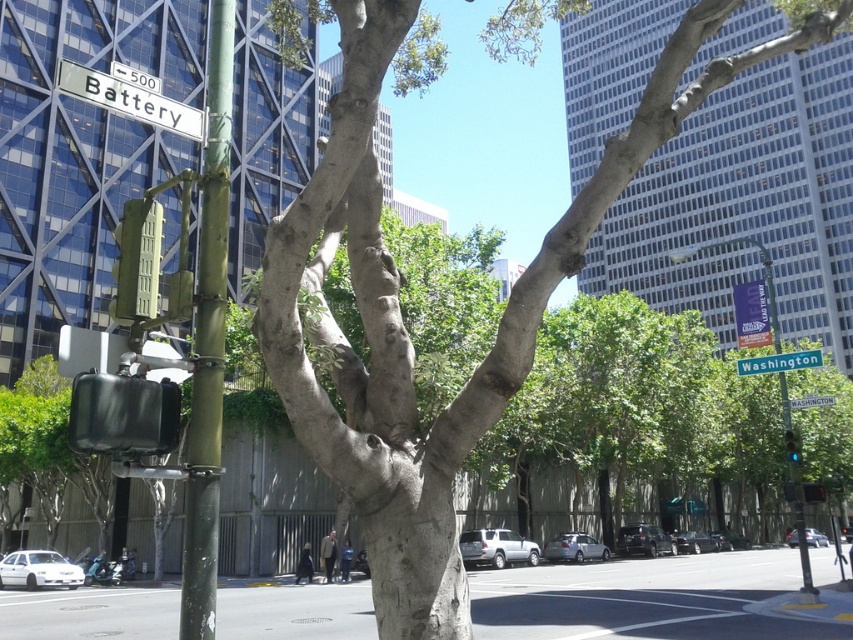
Question: Which point appears closest to the camera in this image?

Choices:
 (A) (567, 234)
 (B) (157, 236)
 (C) (749, 365)
 (D) (828, 403)

Answer: (B)

Question: Which point appears closest to the camera in this image?

Choices:
 (A) (143, 291)
 (B) (426, 472)

Answer: (A)

Question: Can you confirm if gray asphalt at lower center is positioned below green glass traffic light at center?

Choices:
 (A) yes
 (B) no

Answer: (A)

Question: Does green painted metal pole at left lie in front of green matte traffic light at upper left?

Choices:
 (A) yes
 (B) no

Answer: (A)

Question: Is green painted metal pole at left thinner than green matte traffic light at upper left?

Choices:
 (A) yes
 (B) no

Answer: (B)

Question: Which object appears farthest from the camera in this image?

Choices:
 (A) white matte street sign at upper left
 (B) green metallic street sign at center
 (C) green plastic street sign at upper center
 (D) smooth gray bark at center

Answer: (C)